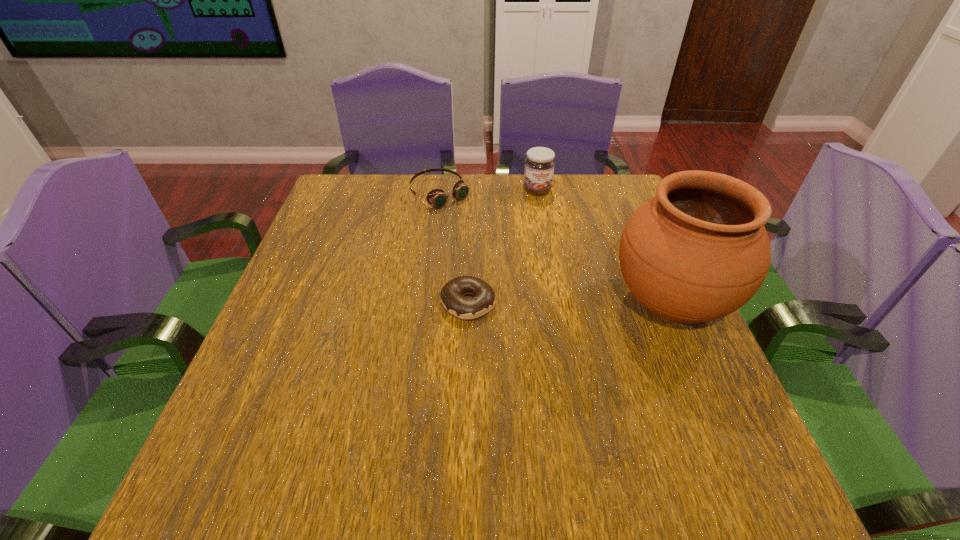
At what (x,y) coordinates should I click in order to perform the action: click on vacant space at the far left corner of the desktop. Please return your answer as a coordinate pair (x, y). The width and height of the screenshot is (960, 540). Looking at the image, I should click on (337, 195).

Locate an element on the screen. unoccupied position between the third shortest object and the third tallest object is located at coordinates pyautogui.click(x=489, y=192).

At what (x,y) coordinates should I click in order to perform the action: click on vacant area between the doughnut and the rightmost object. Please return your answer as a coordinate pair (x, y). Image resolution: width=960 pixels, height=540 pixels. Looking at the image, I should click on (569, 303).

Where is `free space between the third object from left to right and the third tallest object`? free space between the third object from left to right and the third tallest object is located at coordinates (489, 192).

This screenshot has width=960, height=540. Find the location of `blank region between the second shortest object and the pottery`. blank region between the second shortest object and the pottery is located at coordinates (555, 248).

In order to click on unoccupied area between the third object from left to right and the second shortest object in this screenshot , I will do `click(489, 192)`.

I want to click on vacant region between the second shortest object and the third object from left to right, so click(x=489, y=192).

Find the location of `empty space between the shortest object and the tallest object`. empty space between the shortest object and the tallest object is located at coordinates (569, 303).

Locate an element on the screen. The height and width of the screenshot is (540, 960). vacant space in between the third tallest object and the third shortest object is located at coordinates (489, 192).

Identify the location of vacant space that is in between the second object from right to left and the goggles. Image resolution: width=960 pixels, height=540 pixels. (489, 192).